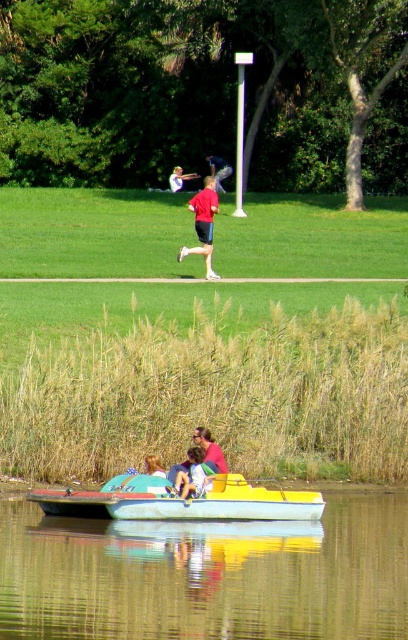
Can you confirm if yellow plastic boat at center is thinner than red shirt at center?

In fact, yellow plastic boat at center might be wider than red shirt at center.

Does yellow plastic boat at center appear on the left side of red shirt at center?

Yes, yellow plastic boat at center is to the left of red shirt at center.

Does point (117, 477) come closer to viewer compared to point (210, 164)?

Yes, point (117, 477) is in front of point (210, 164).

The image size is (408, 640). I want to click on yellow plastic boat at center, so click(181, 500).

Is blue fabric shirt at center bigger than light brown hair at center?

Indeed, blue fabric shirt at center has a larger size compared to light brown hair at center.

Is blue fabric shirt at center above light brown hair at center?

No, blue fabric shirt at center is not above light brown hair at center.

Who is more forward, (193, 476) or (153, 460)?

Positioned in front is point (193, 476).

You are a GUI agent. You are given a task and a screenshot of the screen. Output one action in this format:
    pyautogui.click(x=<x>, y=<y>)
    Task: Click on the blue fabric shirt at center
    This screenshot has width=408, height=640.
    Given the screenshot: What is the action you would take?
    pyautogui.click(x=193, y=476)

Who is taller, matte red shorts at center or light brown hair at center?

With more height is matte red shorts at center.

Who is positioned more to the right, matte red shorts at center or light brown hair at center?

matte red shorts at center

This screenshot has width=408, height=640. What are the coordinates of `matte red shorts at center` in the screenshot? It's located at (204, 225).